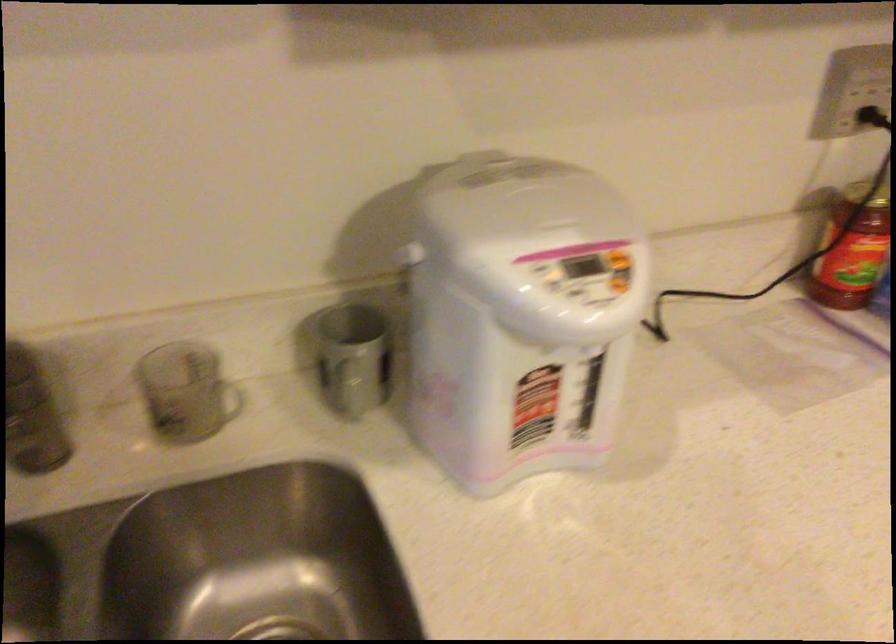
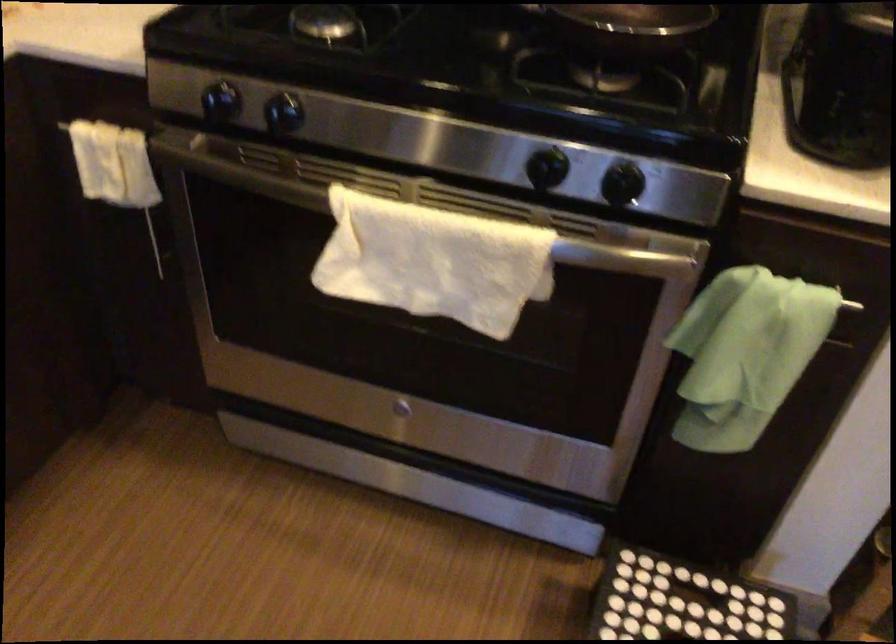
First-person continuous shooting, in which direction is the camera rotating?

The camera rotated toward right-down.